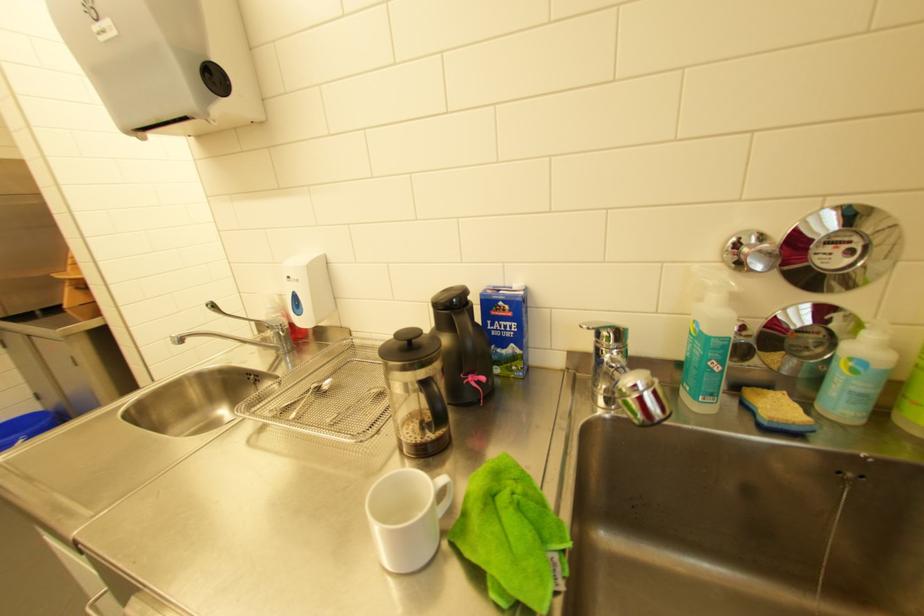
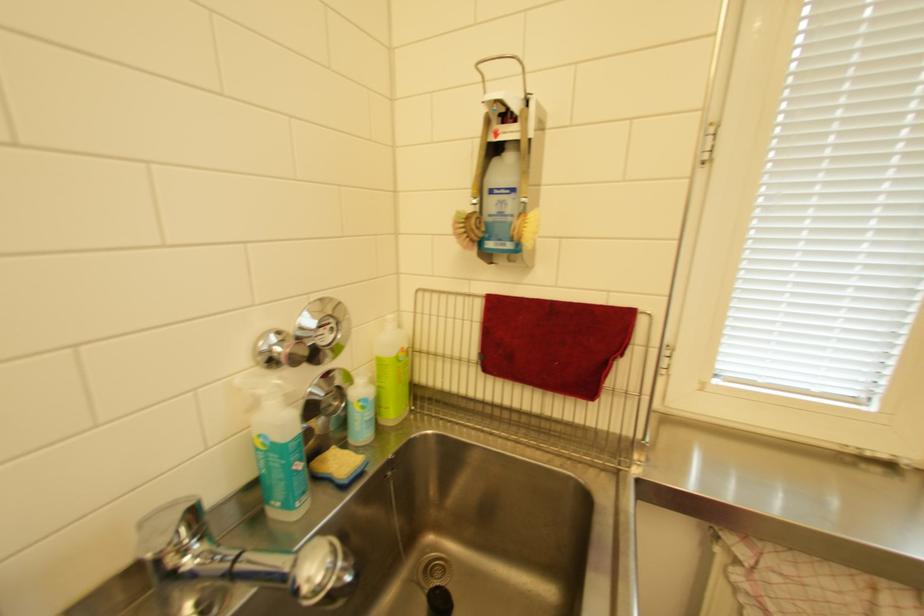
Question: Based on the continuous images, in which direction is the camera rotating? Reply with the corresponding letter.

Choices:
 (A) Left
 (B) Right
 (C) Up
 (D) Down

Answer: (B)